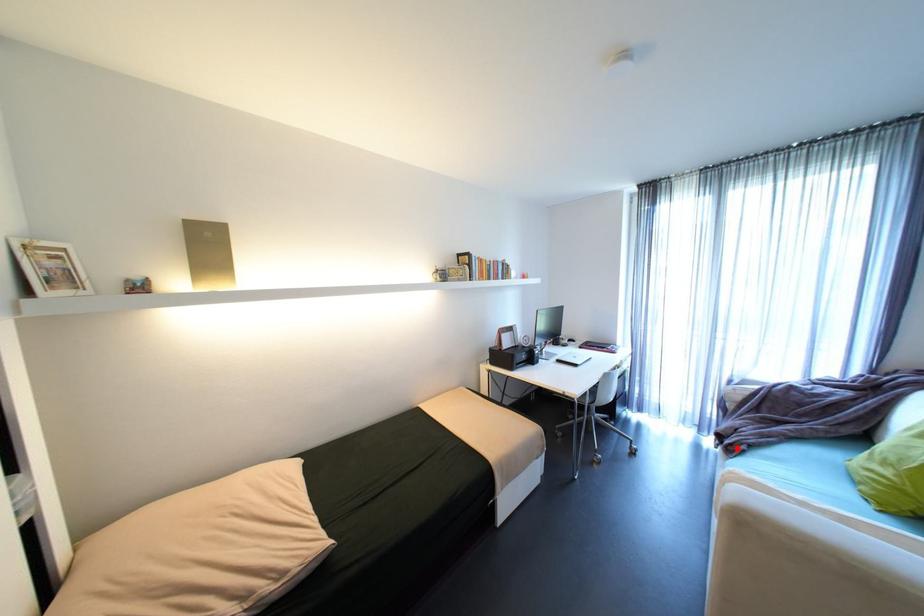
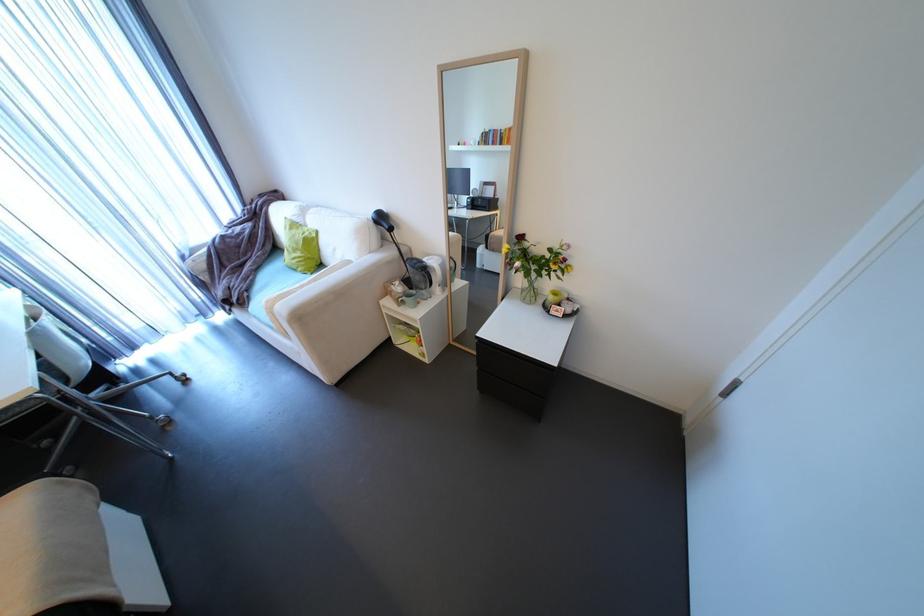
Question: I am providing you with two images of the same scene from different viewpoints. A red point is marked on the first image. Is the red point's position out of view in image 2?

Choices:
 (A) Yes
 (B) No

Answer: (B)